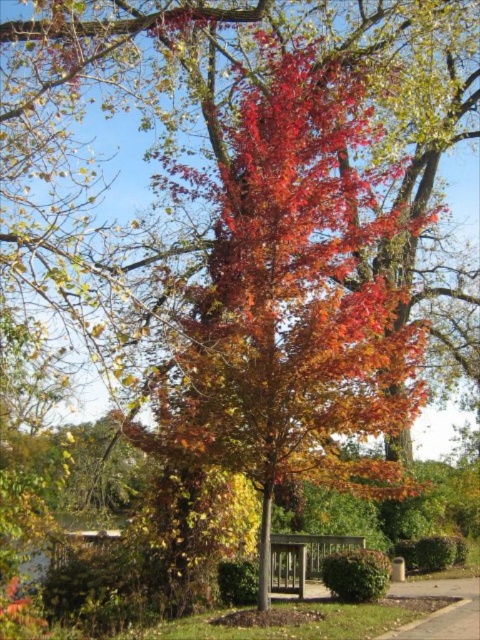
Question: Which of the following is the farthest from the observer?

Choices:
 (A) (367, 193)
 (B) (277, 582)

Answer: (A)

Question: Can you confirm if shiny red leaves at center is bigger than wooden park bench at center?

Choices:
 (A) yes
 (B) no

Answer: (A)

Question: Is shiny red leaves at center to the left of wooden park bench at center from the viewer's perspective?

Choices:
 (A) no
 (B) yes

Answer: (A)

Question: Is shiny red leaves at center thinner than wooden park bench at center?

Choices:
 (A) yes
 (B) no

Answer: (B)

Question: Which point is closer to the camera taking this photo?

Choices:
 (A) (288, 538)
 (B) (274, 188)

Answer: (B)